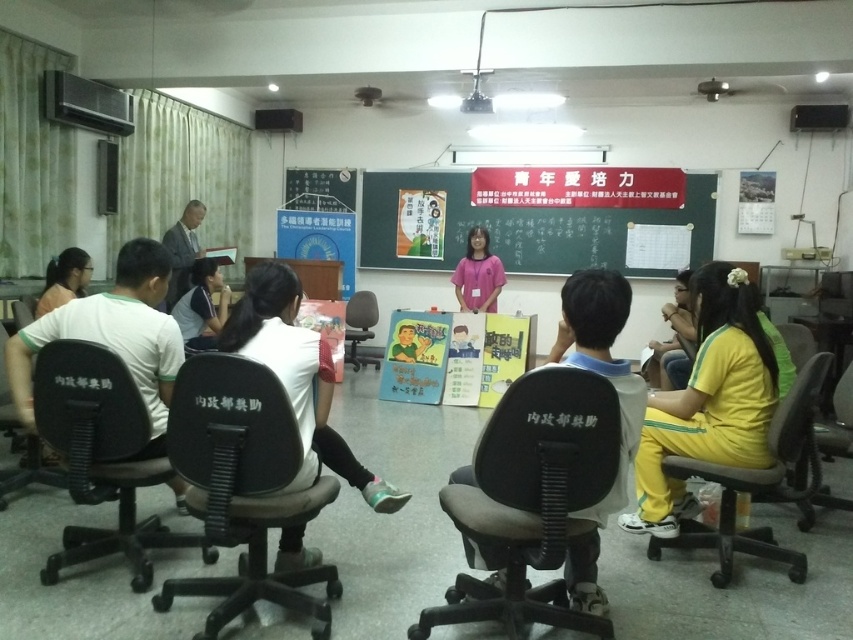
Can you confirm if gray fabric swivel chair at center is thinner than black plastic chair at left?

In fact, gray fabric swivel chair at center might be wider than black plastic chair at left.

Does gray fabric swivel chair at center appear under black plastic chair at left?

Yes, gray fabric swivel chair at center is below black plastic chair at left.

Describe the element at coordinates (532, 497) in the screenshot. I see `gray fabric swivel chair at center` at that location.

Locate an element on the screen. gray fabric swivel chair at center is located at coordinates pyautogui.click(x=532, y=497).

In the scene shown: Is yellow fabric swivel chair at lower right smaller than matte black shirt at left?

No.

Which is in front, point (816, 452) or point (57, 289)?

Point (816, 452)

I want to click on yellow fabric swivel chair at lower right, so click(x=758, y=483).

Does black leather swivel chair at lower left have a greater width compared to black plastic chair at center?

Yes.

Does point (195, 404) come behind point (347, 326)?

No, (195, 404) is closer to viewer.

The height and width of the screenshot is (640, 853). What are the coordinates of `black leather swivel chair at lower left` in the screenshot? It's located at (242, 484).